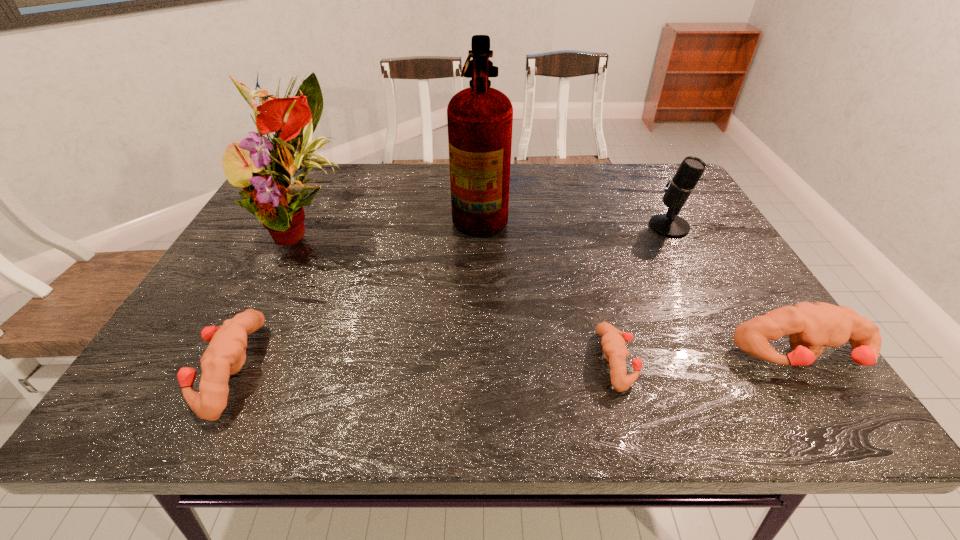
To ensure equal spacing by inserting another puncher among them, please point out a vacant spot for this new puncher. Please provide its 2D coordinates. Your answer should be formatted as a tuple, i.e. [(x, y)], where the tuple contains the x and y coordinates of a point satisfying the conditions above.

[(424, 365)]